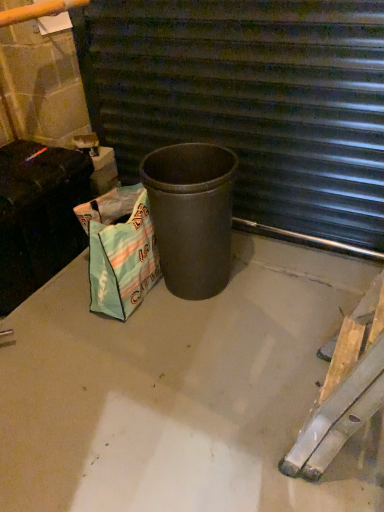
Question: From the image's perspective, is smooth concrete at center located beneath textured green shopping bag at lower left?

Choices:
 (A) no
 (B) yes

Answer: (B)

Question: Considering the relative sizes of smooth concrete at center and textured green shopping bag at lower left in the image provided, is smooth concrete at center smaller than textured green shopping bag at lower left?

Choices:
 (A) no
 (B) yes

Answer: (A)

Question: Is smooth concrete at center thinner than textured green shopping bag at lower left?

Choices:
 (A) yes
 (B) no

Answer: (B)

Question: Is smooth concrete at center wider than textured green shopping bag at lower left?

Choices:
 (A) no
 (B) yes

Answer: (B)

Question: Is smooth concrete at center facing away from textured green shopping bag at lower left?

Choices:
 (A) no
 (B) yes

Answer: (A)

Question: From the image's perspective, is smooth concrete at center located above textured green shopping bag at lower left?

Choices:
 (A) yes
 (B) no

Answer: (B)

Question: Considering the relative sizes of matte black trash can at center and smooth concrete at center in the image provided, is matte black trash can at center thinner than smooth concrete at center?

Choices:
 (A) yes
 (B) no

Answer: (A)

Question: Considering the relative positions of matte black trash can at center and smooth concrete at center in the image provided, is matte black trash can at center in front of smooth concrete at center?

Choices:
 (A) yes
 (B) no

Answer: (B)

Question: From the image's perspective, is matte black trash can at center above smooth concrete at center?

Choices:
 (A) yes
 (B) no

Answer: (A)

Question: Does matte black trash can at center turn towards smooth concrete at center?

Choices:
 (A) yes
 (B) no

Answer: (A)

Question: From the image's perspective, is matte black trash can at center under smooth concrete at center?

Choices:
 (A) yes
 (B) no

Answer: (B)

Question: Is matte black trash can at center not inside smooth concrete at center?

Choices:
 (A) no
 (B) yes

Answer: (B)

Question: Is textured green shopping bag at lower left surrounded by matte black trash can at center?

Choices:
 (A) no
 (B) yes

Answer: (A)